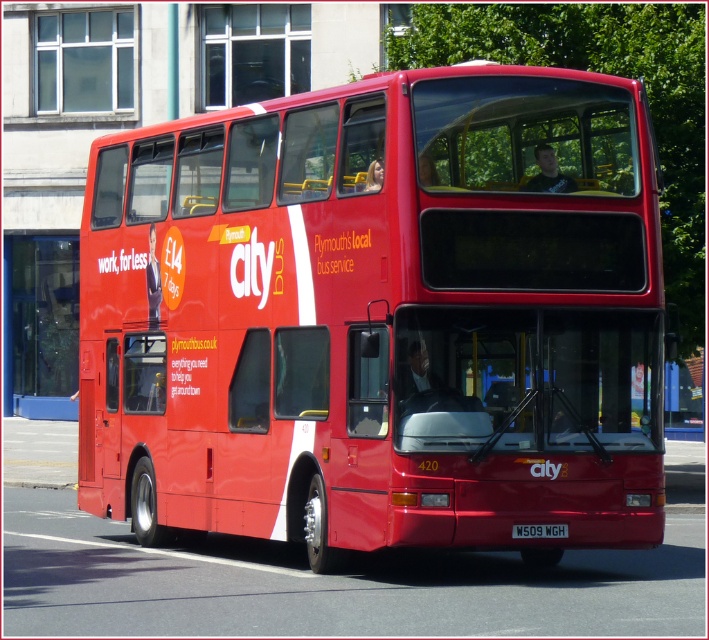
Who is more forward, (211, 268) or (527, 529)?

Point (527, 529)

Can you confirm if shiny red bus at center is positioned to the right of black plastic license plate at center?

Correct, you'll find shiny red bus at center to the right of black plastic license plate at center.

At what (x,y) coordinates should I click in order to perform the action: click on shiny red bus at center. Please return your answer as a coordinate pair (x, y). The image size is (709, 640). Looking at the image, I should click on (379, 316).